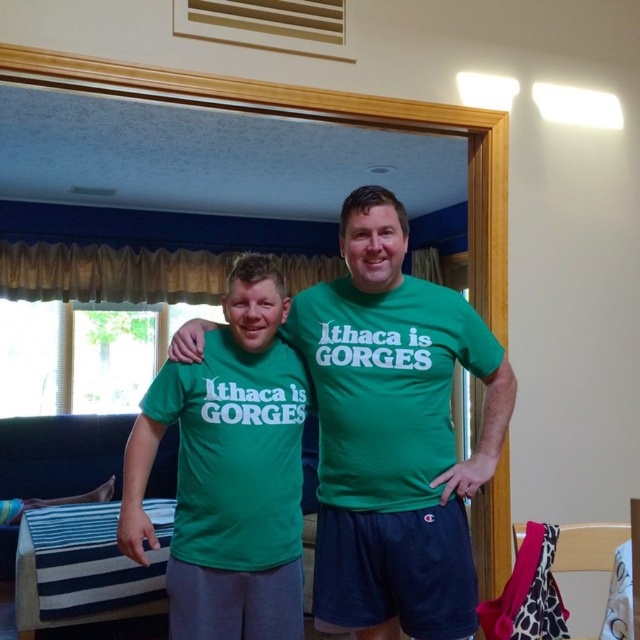
Which of these two, green matte t-shirt at center or matte green t-shirt at center, stands taller?

green matte t-shirt at center

Is green matte t-shirt at center thinner than matte green t-shirt at center?

In fact, green matte t-shirt at center might be wider than matte green t-shirt at center.

Which is in front, point (465, 468) or point (232, 550)?

Point (232, 550) is more forward.

At what (x,y) coordinates should I click in order to perform the action: click on green matte t-shirt at center. Please return your answer as a coordinate pair (x, y). Looking at the image, I should click on (394, 433).